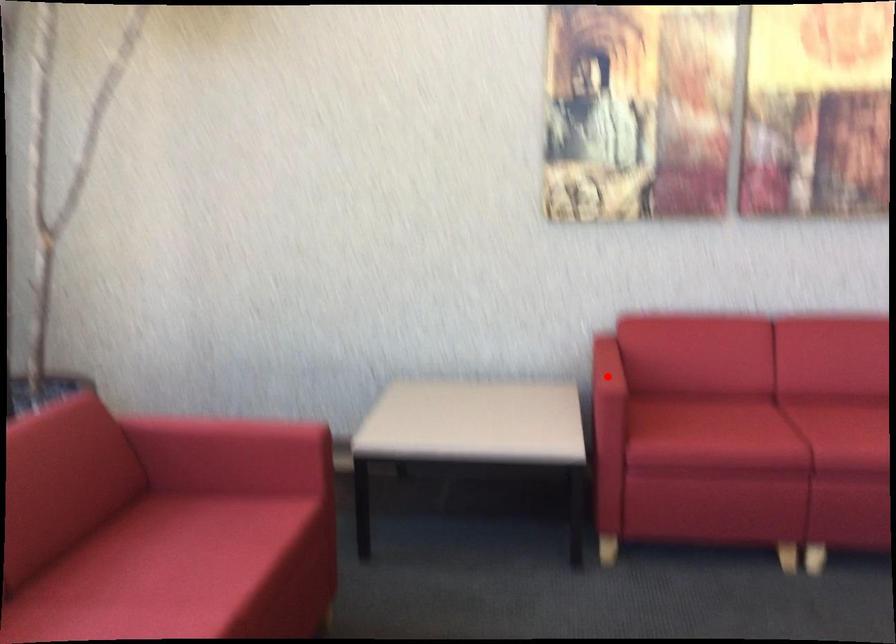
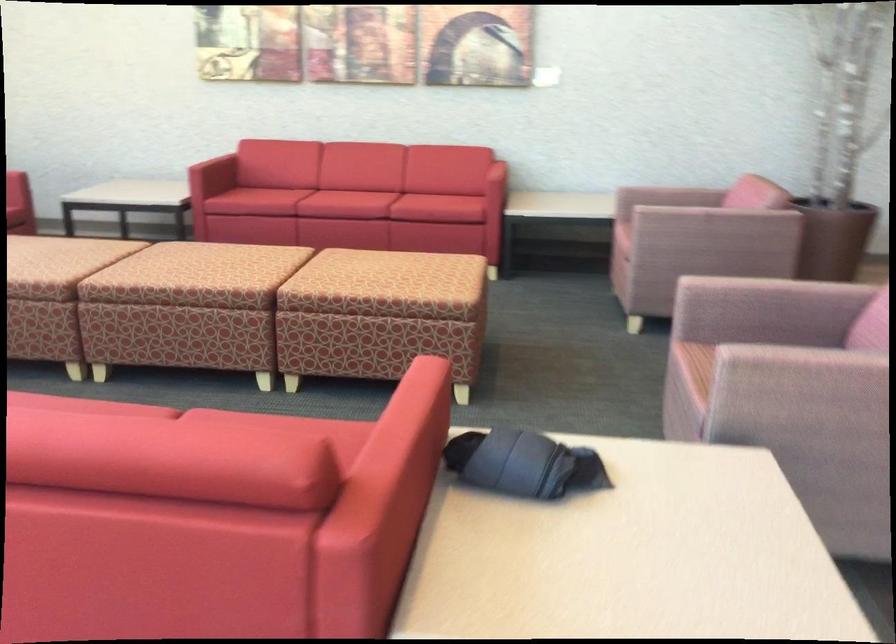
Question: I am providing you with two images of the same scene from different viewpoints. A red point is marked on the first image. Can you still see the location of the red point in image 2?

Choices:
 (A) Yes
 (B) No

Answer: (B)